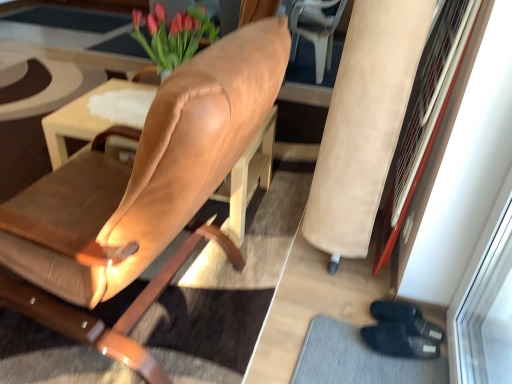
In order to click on leather armchair at upper right in this screenshot , I will do `click(315, 29)`.

The height and width of the screenshot is (384, 512). What do you see at coordinates (80, 120) in the screenshot?
I see `matte brown table at center` at bounding box center [80, 120].

The height and width of the screenshot is (384, 512). I want to click on suede-like beige armchair at right, so click(x=364, y=122).

From the image's perspective, does leather chair at center appear lower than suede-like beige armchair at right?

Yes, from the image's perspective, leather chair at center is below suede-like beige armchair at right.

Is leather chair at center oriented towards suede-like beige armchair at right?

No, leather chair at center does not turn towards suede-like beige armchair at right.

Measure the distance between leather chair at center and suede-like beige armchair at right.

The distance of leather chair at center from suede-like beige armchair at right is 23.97 inches.

Is suede-like beige armchair at right surrounded by leather chair at center?

No, leather chair at center does not contain suede-like beige armchair at right.

Is black fabric doormat at lower right oriented away from matte brown table at center?

No, black fabric doormat at lower right's orientation is not away from matte brown table at center.

From the image's perspective, is black fabric doormat at lower right beneath matte brown table at center?

Yes.

Is there a large distance between black fabric doormat at lower right and matte brown table at center?

Yes, black fabric doormat at lower right is far from matte brown table at center.

In terms of size, does black fabric doormat at lower right appear bigger or smaller than matte brown table at center?

black fabric doormat at lower right is smaller than matte brown table at center.

Would you say suede-like beige armchair at right is a long distance from leather armchair at upper right?

Yes, suede-like beige armchair at right and leather armchair at upper right are located far from each other.

Looking at this image, in terms of size, does suede-like beige armchair at right appear bigger or smaller than leather armchair at upper right?

In the image, suede-like beige armchair at right appears to be smaller than leather armchair at upper right.

Consider the image. From a real-world perspective, relative to leather armchair at upper right, is suede-like beige armchair at right vertically above or below?

suede-like beige armchair at right is above leather armchair at upper right.

Considering the sizes of objects suede-like beige armchair at right and leather armchair at upper right in the image provided, who is thinner, suede-like beige armchair at right or leather armchair at upper right?

With smaller width is suede-like beige armchair at right.

Which is correct: leather chair at center is inside black fabric doormat at lower right, or outside of it?

leather chair at center is spatially situated outside black fabric doormat at lower right.

Considering the relative positions of leather chair at center and black fabric doormat at lower right in the image provided, is leather chair at center to the left or to the right of black fabric doormat at lower right?

leather chair at center is to the left of black fabric doormat at lower right.

Based on the photo, is leather chair at center aimed at black fabric doormat at lower right?

No, leather chair at center is not facing towards black fabric doormat at lower right.

From a real-world perspective, is leather chair at center below black fabric doormat at lower right?

Incorrect, from a real-world perspective, leather chair at center is higher than black fabric doormat at lower right.

Is black fabric doormat at lower right far from leather chair at center?

No.

Find the location of a particular element. chair in front of the black fabric doormat at lower right is located at coordinates (167, 166).

Is black fabric doormat at lower right facing away from leather chair at center?

No, black fabric doormat at lower right is not facing away from leather chair at center.

Which of these two, black fabric doormat at lower right or leather chair at center, stands shorter?

With less height is black fabric doormat at lower right.

Does leather armchair at upper right appear on the left side of leather chair at center?

No, leather armchair at upper right is not to the left of leather chair at center.

Which is closer to the camera, [298,18] or [140,258]?

Point [298,18] is farther from the camera than point [140,258].

Considering the sizes of leather armchair at upper right and leather chair at center in the image, is leather armchair at upper right wider or thinner than leather chair at center?

Clearly, leather armchair at upper right has less width compared to leather chair at center.

The width and height of the screenshot is (512, 384). I want to click on doormat below the matte brown table at center (from a real-world perspective), so click(x=358, y=359).

Is matte brown table at center at the left side of black fabric doormat at lower right?

Yes, matte brown table at center is to the left of black fabric doormat at lower right.

Is point (84, 112) positioned after point (348, 347)?

Yes, point (84, 112) is behind point (348, 347).

The width and height of the screenshot is (512, 384). Identify the location of beige above the leather chair at center (from the image's perspective). (364, 122).

The image size is (512, 384). Identify the location of table located on the left of black fabric doormat at lower right. (80, 120).

When comparing their distances from black fabric doormat at lower right, does suede-like beige armchair at right or leather armchair at upper right seem further?

leather armchair at upper right is further to black fabric doormat at lower right.

Which object lies nearer to the anchor point suede-like beige armchair at right, leather chair at center or leather armchair at upper right?

The object closer to suede-like beige armchair at right is leather chair at center.

Considering their positions, is leather armchair at upper right positioned closer to leather chair at center than suede-like beige armchair at right?

Among the two, suede-like beige armchair at right is located nearer to leather chair at center.

Considering their positions, is leather armchair at upper right positioned further to matte brown table at center than suede-like beige armchair at right?

leather armchair at upper right is further to matte brown table at center.

Looking at the image, which one is located further to black fabric doormat at lower right, matte brown table at center or leather chair at center?

matte brown table at center lies further to black fabric doormat at lower right than the other object.

When comparing their distances from suede-like beige armchair at right, does black fabric doormat at lower right or leather chair at center seem closer?

Among the two, black fabric doormat at lower right is located nearer to suede-like beige armchair at right.

Which object lies further to the anchor point suede-like beige armchair at right, leather armchair at upper right or leather chair at center?

leather armchair at upper right is further to suede-like beige armchair at right.

Estimate the real-world distances between objects in this image. Which object is closer to matte brown table at center, leather armchair at upper right or leather chair at center?

leather chair at center is positioned closer to the anchor matte brown table at center.

The image size is (512, 384). What are the coordinates of `doormat between leather chair at center and matte brown table at center along the z-axis` in the screenshot? It's located at (358, 359).

Where is `table situated between leather chair at center and suede-like beige armchair at right from left to right`? table situated between leather chair at center and suede-like beige armchair at right from left to right is located at coordinates (80, 120).

This screenshot has width=512, height=384. What are the coordinates of `table positioned between black fabric doormat at lower right and leather armchair at upper right from near to far` in the screenshot? It's located at (80, 120).

I want to click on doormat between leather chair at center and leather armchair at upper right from front to back, so click(358, 359).